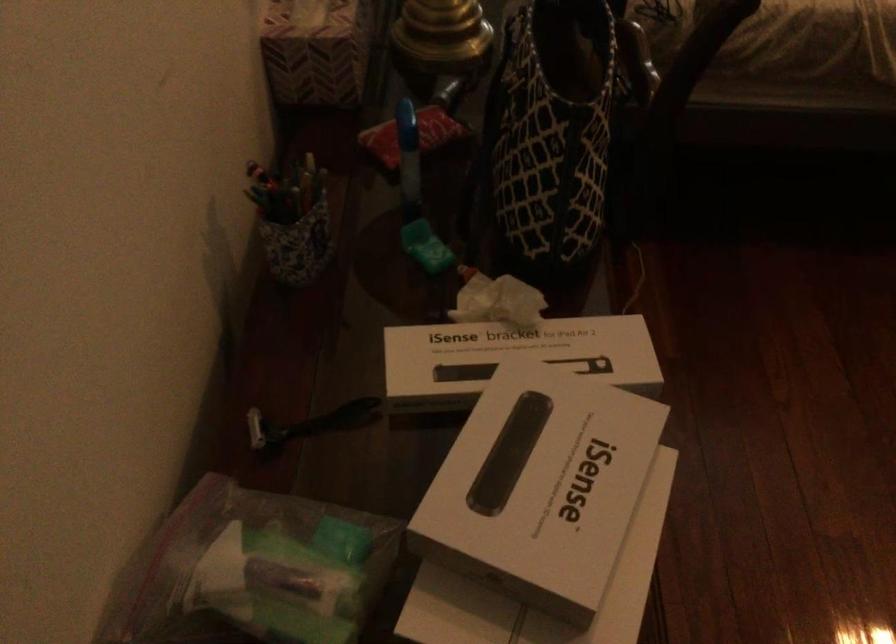
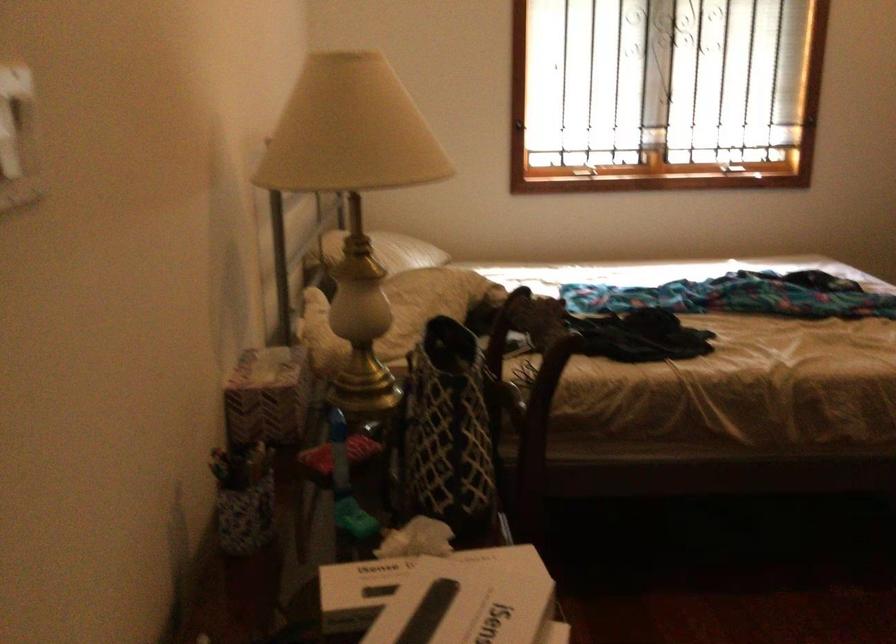
Question: Based on the continuous images, in which direction is the camera rotating? Reply with the corresponding letter.

Choices:
 (A) Left
 (B) Right
 (C) Up
 (D) Down

Answer: (C)